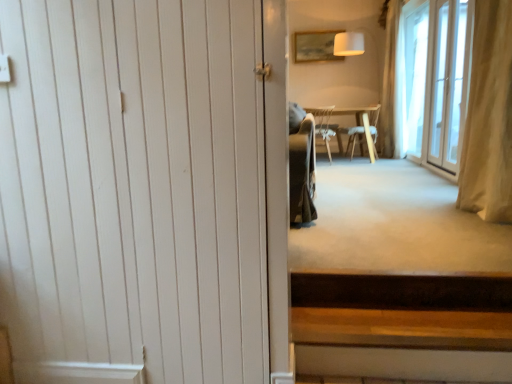
This screenshot has width=512, height=384. I want to click on free space above wooden stairs at lower right (from a real-world perspective), so click(410, 322).